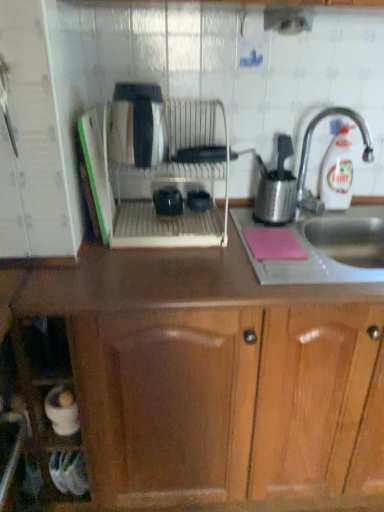
This screenshot has width=384, height=512. I want to click on free spot in front of matte black mugs at center, which is the second appliance in right-to-left order, so click(x=163, y=236).